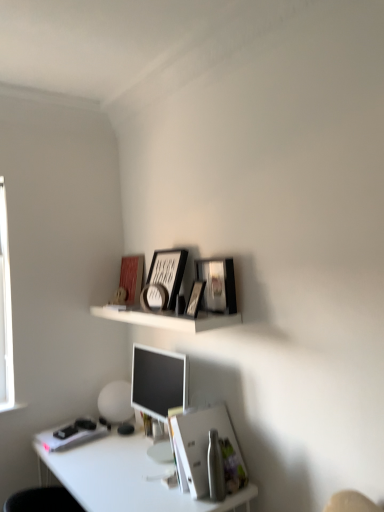
Question: Based on their positions, is white paper at lower center located to the left or right of matte black picture frame at upper center, placed as the second picture frame when sorted from right to left?

Choices:
 (A) right
 (B) left

Answer: (A)

Question: From a real-world perspective, is white paper at lower center physically located above or below matte black picture frame at upper center, acting as the third picture frame starting from the left?

Choices:
 (A) above
 (B) below

Answer: (B)

Question: Which is farther from the matte red book cover at upper center?

Choices:
 (A) white glossy desk at lower left
 (B) white matte shelf at upper center
 (C) white matte globe at lower left
 (D) matte black picture frame at upper center, acting as the third picture frame starting from the left
 (E) white paper at lower center

Answer: (E)

Question: Which object is positioned farthest from the white matte book at lower left?

Choices:
 (A) matte black picture frame at upper center, acting as the third picture frame starting from the left
 (B) white glossy desk at lower left
 (C) matte black picture frame at upper center, positioned as the second picture frame in left-to-right order
 (D) metallic silver picture frame at upper center, which is the 4th picture frame in right-to-left order
 (E) white matte globe at lower left

Answer: (A)